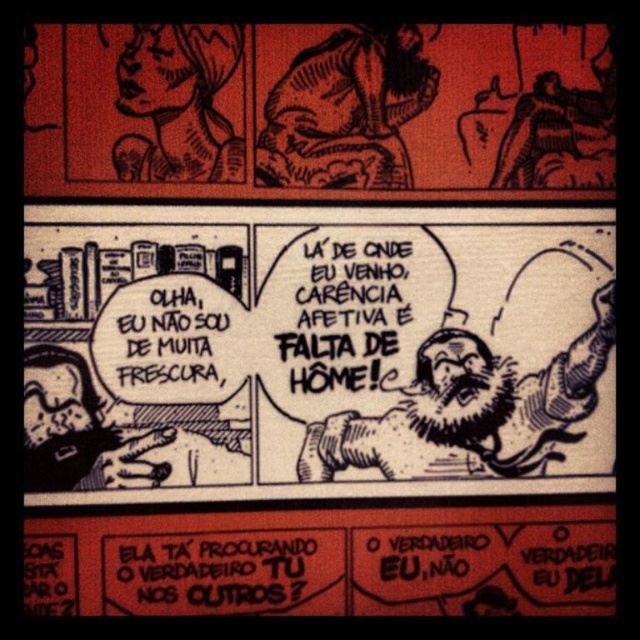
Which is above, black ink speech bubble at center or black ink speech bubble at upper center?

black ink speech bubble at upper center is above.

Measure the distance from black ink speech bubble at center to black ink speech bubble at upper center.

The distance of black ink speech bubble at center from black ink speech bubble at upper center is 5.90 inches.

Where is `black ink speech bubble at center`? The image size is (640, 640). black ink speech bubble at center is located at coordinates (314, 349).

Can you confirm if black ink speech bubble at center is positioned to the left of black paper speech bubble at lower center?

Correct, you'll find black ink speech bubble at center to the left of black paper speech bubble at lower center.

Where is `black ink speech bubble at center`? The image size is (640, 640). black ink speech bubble at center is located at coordinates (314, 349).

Image resolution: width=640 pixels, height=640 pixels. I want to click on black ink speech bubble at center, so click(314, 349).

Can you confirm if black ink speech bubble at upper center is taller than black paper speech bubble at lower center?

Yes.

How far apart are black ink speech bubble at upper center and black paper speech bubble at lower center?

black ink speech bubble at upper center and black paper speech bubble at lower center are 16.83 inches apart.

Describe the element at coordinates (320, 106) in the screenshot. I see `black ink speech bubble at upper center` at that location.

I want to click on black ink speech bubble at upper center, so click(x=320, y=106).